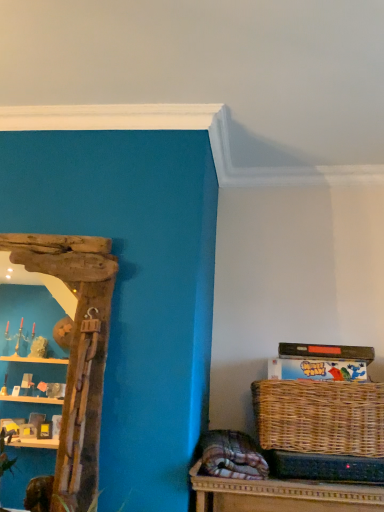
Describe the element at coordinates (76, 353) in the screenshot. This screenshot has height=512, width=384. I see `driftwood mirror at left` at that location.

What is the approximate height of driftwood mirror at left?

1.07 meters.

Locate an element on the screen. The image size is (384, 512). driftwood mirror at left is located at coordinates (76, 353).

This screenshot has height=512, width=384. Describe the element at coordinates (320, 417) in the screenshot. I see `woven brown picnic basket at lower right` at that location.

What is the approximate height of woven brown picnic basket at lower right?

woven brown picnic basket at lower right is 11.96 inches in height.

You are a GUI agent. You are given a task and a screenshot of the screen. Output one action in this format:
    pyautogui.click(x=<x>, y=<y>)
    Task: Click on the woven brown picnic basket at lower right
    The image size is (384, 512).
    Given the screenshot: What is the action you would take?
    pyautogui.click(x=320, y=417)

You are a GUI agent. You are given a task and a screenshot of the screen. Output one action in this format:
    pyautogui.click(x=<x>, y=<y>)
    Task: Click on the driftwood mirror at left
    This screenshot has width=384, height=512.
    Given the screenshot: What is the action you would take?
    pyautogui.click(x=76, y=353)

In the image, is woven brown picnic basket at lower right on the left side or the right side of driftwood mirror at left?

Clearly, woven brown picnic basket at lower right is on the right of driftwood mirror at left in the image.

Considering their positions, is woven brown picnic basket at lower right located in front of or behind driftwood mirror at left?

woven brown picnic basket at lower right is positioned farther from the viewer than driftwood mirror at left.

Between point (306, 451) and point (62, 436), which one is positioned behind?

The point (306, 451) is farther.

From the image's perspective, which one is positioned higher, woven brown picnic basket at lower right or driftwood mirror at left?

From the image's view, driftwood mirror at left is above.

From a real-world perspective, which is physically above, woven brown picnic basket at lower right or driftwood mirror at left?

driftwood mirror at left is physically above.

Which of these two, woven brown picnic basket at lower right or driftwood mirror at left, is wider?

Wider between the two is woven brown picnic basket at lower right.

Considering the sizes of woven brown picnic basket at lower right and driftwood mirror at left in the image, is woven brown picnic basket at lower right taller or shorter than driftwood mirror at left?

Considering their sizes, woven brown picnic basket at lower right has less height than driftwood mirror at left.

Is woven brown picnic basket at lower right bigger than driftwood mirror at left?

Correct, woven brown picnic basket at lower right is larger in size than driftwood mirror at left.

Is woven brown picnic basket at lower right positioned beyond the bounds of driftwood mirror at left?

Yes, woven brown picnic basket at lower right is located beyond the bounds of driftwood mirror at left.

Consider the image. Is woven brown picnic basket at lower right touching driftwood mirror at left?

There is a gap between woven brown picnic basket at lower right and driftwood mirror at left.

Is woven brown picnic basket at lower right positioned with its back to driftwood mirror at left?

No, driftwood mirror at left is not at the back of woven brown picnic basket at lower right.

How many degrees apart are the facing directions of woven brown picnic basket at lower right and driftwood mirror at left?

The angular difference between woven brown picnic basket at lower right and driftwood mirror at left is 1.04 degrees.

Find the location of `shelf above the woven brown picnic basket at lower right (from a real-world perspective)`. shelf above the woven brown picnic basket at lower right (from a real-world perspective) is located at coordinates (76, 353).

Is driftwood mirror at left at the left side of woven brown picnic basket at lower right?

Yes.

In the image, is driftwood mirror at left positioned in front of or behind woven brown picnic basket at lower right?

Visually, driftwood mirror at left is located in front of woven brown picnic basket at lower right.

Which is closer to the camera, (97, 339) or (256, 408)?

Positioned in front is point (97, 339).

From the picture: From the image's perspective, which is below, driftwood mirror at left or woven brown picnic basket at lower right?

woven brown picnic basket at lower right appears lower in the image.

From a real-world perspective, between driftwood mirror at left and woven brown picnic basket at lower right, who is vertically higher?

In real-world perspective, driftwood mirror at left is above.

Consider the image. Can you confirm if driftwood mirror at left is thinner than woven brown picnic basket at lower right?

Yes, driftwood mirror at left is thinner than woven brown picnic basket at lower right.

From their relative heights in the image, would you say driftwood mirror at left is taller or shorter than woven brown picnic basket at lower right?

Considering their sizes, driftwood mirror at left has more height than woven brown picnic basket at lower right.

Looking at the image, does driftwood mirror at left seem bigger or smaller compared to woven brown picnic basket at lower right?

Considering their sizes, driftwood mirror at left takes up less space than woven brown picnic basket at lower right.

Does driftwood mirror at left contain woven brown picnic basket at lower right?

Actually, woven brown picnic basket at lower right is outside driftwood mirror at left.

Is driftwood mirror at left directly adjacent to woven brown picnic basket at lower right?

driftwood mirror at left and woven brown picnic basket at lower right are clearly separated.

Is driftwood mirror at left aimed at woven brown picnic basket at lower right?

No, driftwood mirror at left is not aimed at woven brown picnic basket at lower right.

Identify the location of shelf that is in front of the woven brown picnic basket at lower right. The height and width of the screenshot is (512, 384). click(x=76, y=353).

At what (x,y) coordinates should I click in order to perform the action: click on shelf that appears in front of the woven brown picnic basket at lower right. Please return your answer as a coordinate pair (x, y). The width and height of the screenshot is (384, 512). Looking at the image, I should click on (76, 353).

The height and width of the screenshot is (512, 384). I want to click on shelf that is above the woven brown picnic basket at lower right (from the image's perspective), so click(76, 353).